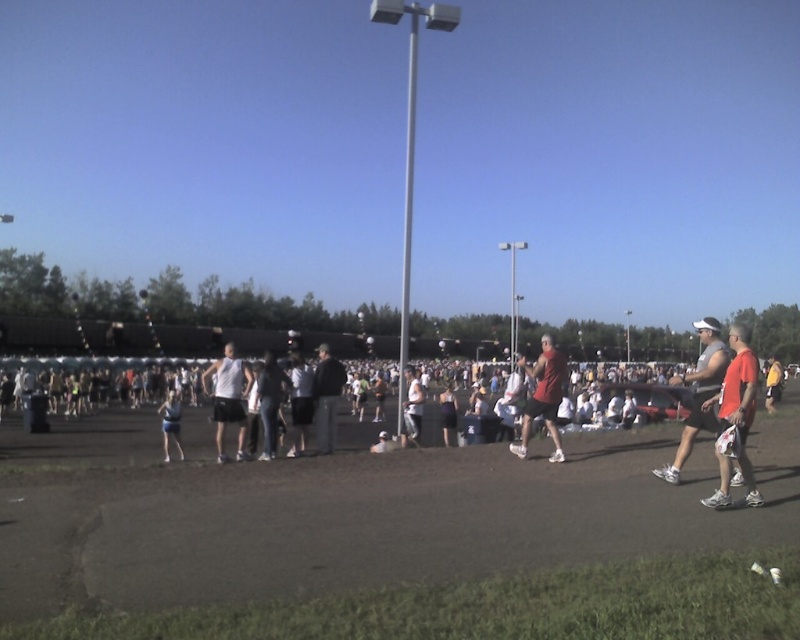
You are navigating through the crowd in the midground of the outdoor scene. You need to move from point A at point (x=230, y=419) to point B at point (x=178, y=412). Which direction should you move relative to your current position?

You should move backward because point (x=230, y=419) is in front of point (x=178, y=412), so to reach point B, you need to move in the opposite direction from where you are facing.